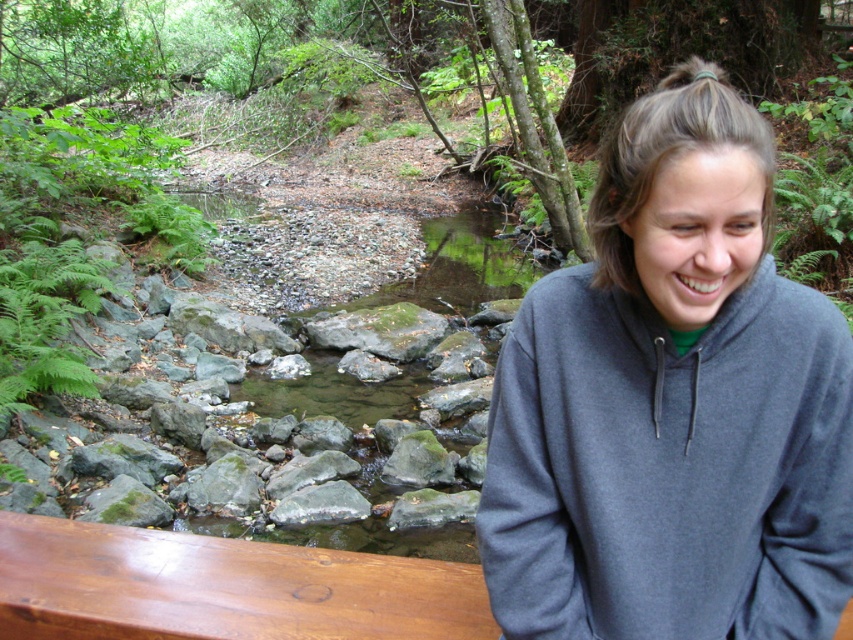
Is point (729, 212) closer to viewer compared to point (175, 576)?

Yes, point (729, 212) is in front of point (175, 576).

Can you confirm if gray fleece sweatshirt at center is positioned to the left of shiny brown wood at lower left?

In fact, gray fleece sweatshirt at center is to the right of shiny brown wood at lower left.

The image size is (853, 640). In order to click on gray fleece sweatshirt at center in this screenshot , I will do `click(672, 404)`.

Image resolution: width=853 pixels, height=640 pixels. In order to click on gray fleece sweatshirt at center in this screenshot , I will do `click(672, 404)`.

Is shiny brown wood at lower left to the left of gray smooth rock at center from the viewer's perspective?

No, shiny brown wood at lower left is not to the left of gray smooth rock at center.

Does shiny brown wood at lower left have a larger size compared to gray smooth rock at center?

Yes.

The height and width of the screenshot is (640, 853). Identify the location of shiny brown wood at lower left. (221, 588).

Locate an element on the screen. The width and height of the screenshot is (853, 640). shiny brown wood at lower left is located at coordinates (221, 588).

The height and width of the screenshot is (640, 853). What do you see at coordinates (672, 404) in the screenshot?
I see `gray fleece sweatshirt at center` at bounding box center [672, 404].

Which is in front, point (808, 358) or point (326, 500)?

Point (808, 358) is more forward.

Identify the location of gray fleece sweatshirt at center. (672, 404).